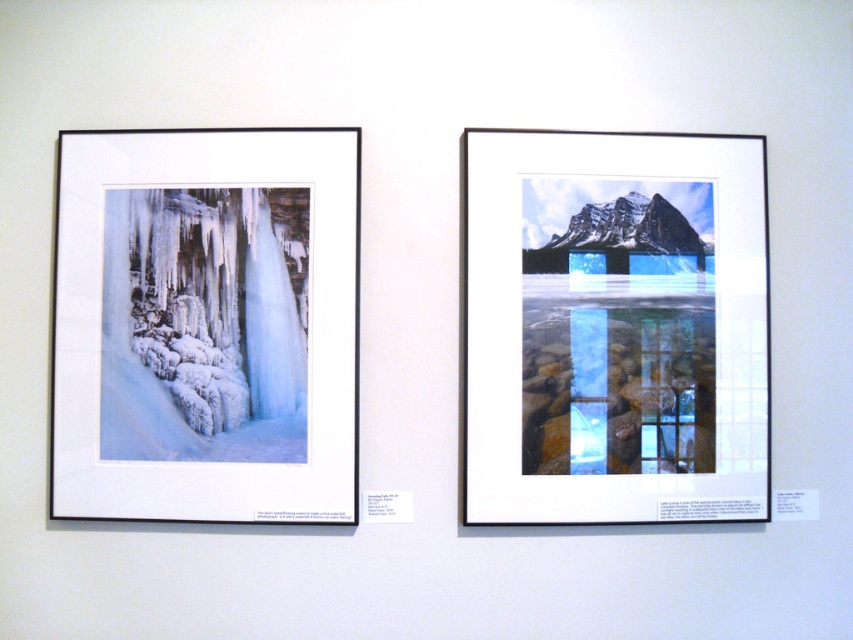
Does white matte paper at upper right have a lesser height compared to white matte paper at left?

Incorrect, white matte paper at upper right's height does not fall short of white matte paper at left's.

Can you confirm if white matte paper at upper right is taller than white matte paper at left?

Correct, white matte paper at upper right is much taller as white matte paper at left.

What do you see at coordinates (613, 326) in the screenshot?
I see `white matte paper at upper right` at bounding box center [613, 326].

Find the location of a particular element. Image resolution: width=853 pixels, height=640 pixels. white matte paper at upper right is located at coordinates [613, 326].